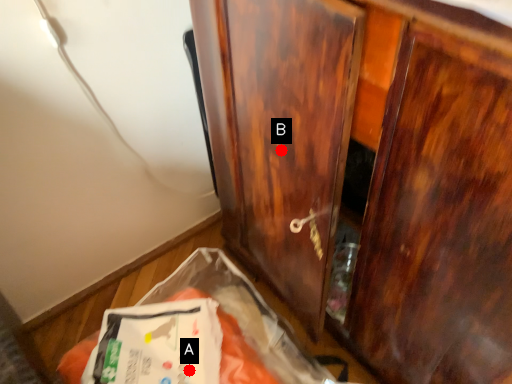
Question: Two points are circled on the image, labeled by A and B beside each circle. Which point is further to the camera?

Choices:
 (A) A is further
 (B) B is further

Answer: (A)